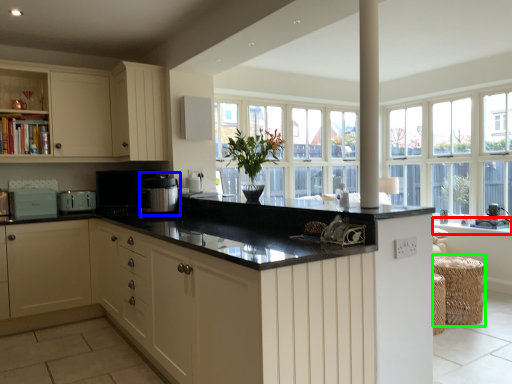
Question: Which object is positioned closest to window sill (highlighted by a red box)? Select from appliance (highlighted by a blue box) and bar stool (highlighted by a green box).

Choices:
 (A) appliance
 (B) bar stool

Answer: (B)